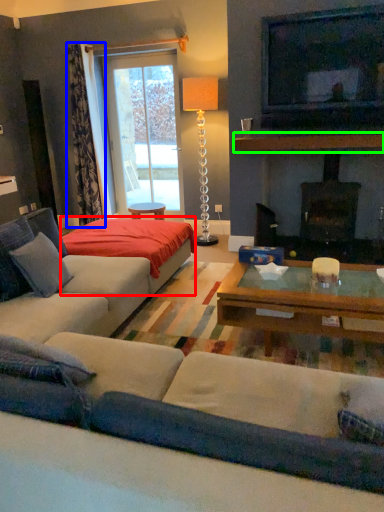
Question: Which object is the farthest from plain (highlighted by a red box)? Choose among these: curtain (highlighted by a blue box) or mantle (highlighted by a green box).

Choices:
 (A) curtain
 (B) mantle

Answer: (A)